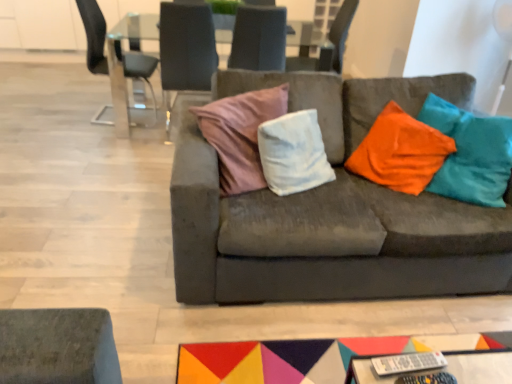
Where is `vacant area that lies in front of metallic glass chair at upper left, which is the 4th chair in right-to-left order`? vacant area that lies in front of metallic glass chair at upper left, which is the 4th chair in right-to-left order is located at coordinates (86, 135).